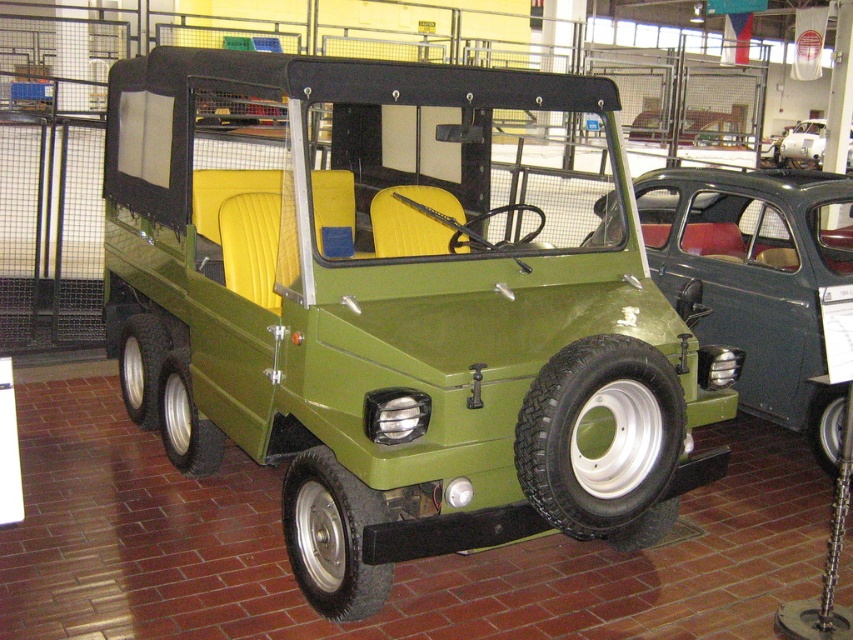
You are a visitor at the museum and want to take a photo of both the green matte pickup truck at center and the metallic silver car at center. Which one should you focus on first if you want to capture both in the same frame without moving your camera?

You should focus on the green matte pickup truck at center first because it is positioned below the metallic silver car at center, so adjusting the camera to include both would require framing from the bottom up.

You are standing at the entrance of the museum and see the vintage green vehicle. There are two points marked on the floor near the vehicle. One is at point (x=624, y=384) and the other at point (x=822, y=132). If you walk towards the vehicle, which point will you encounter first?

Point (x=624, y=384) is in front of point (x=822, y=132), so you will encounter point (x=624, y=384) first as you walk towards the vehicle.